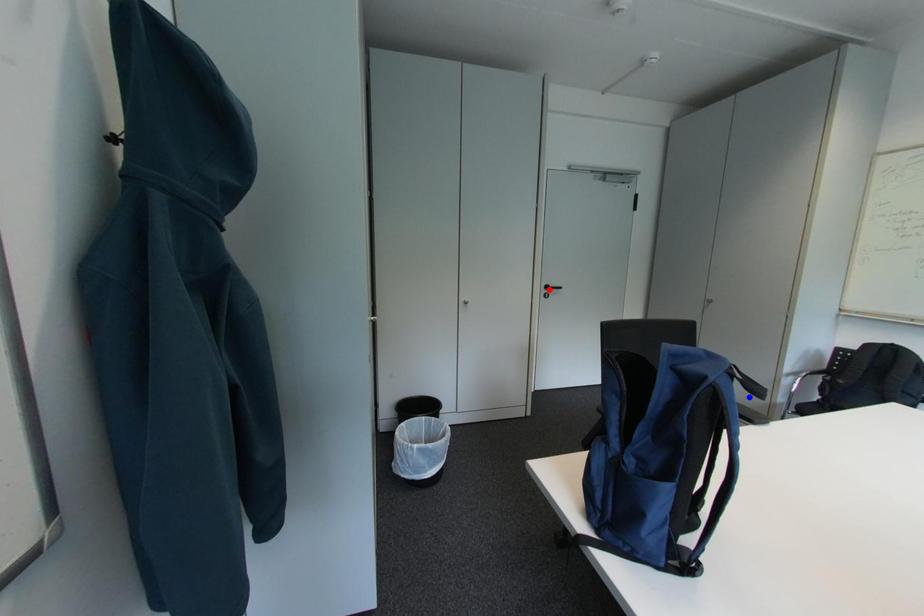
Question: Two points are marked on the image. Which point is closer to the camera?

Choices:
 (A) Blue point is closer.
 (B) Red point is closer.

Answer: (A)